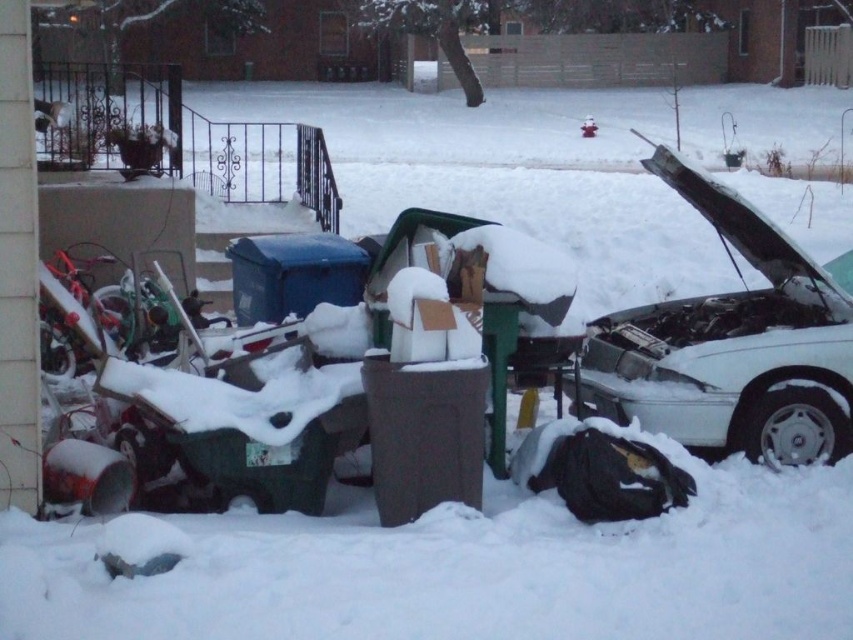
You are standing in the snowy area and want to pick up the brown matte trash can at center and the blue plastic bin at center. Which one do you need to walk closer to first?

The brown matte trash can at center is closer to the viewer than the blue plastic bin at center, so you should pick up the brown matte trash can at center first before moving towards the blue plastic bin at center.

You are trying to determine if the white matte car at right can fit through a narrow alleyway that is only as tall as the blue plastic bin at center. Based on the scene description, will the car fit vertically?

The white matte car at right has a greater height compared to the blue plastic bin at center. Since the alleyway is only as tall as the blue plastic bin at center, the car will not fit vertically because it is taller than the bin.

You are a delivery person trying to place a large package between the brown matte trash can at center and the blue plastic bin at center. The package is 2 meters long. Will there be enough space between them to fit the package?

The brown matte trash can at center and blue plastic bin at center are 2.13 meters apart from each other. Since the package is 2 meters long, there will be enough space to fit it between them as the distance is greater than the package length.